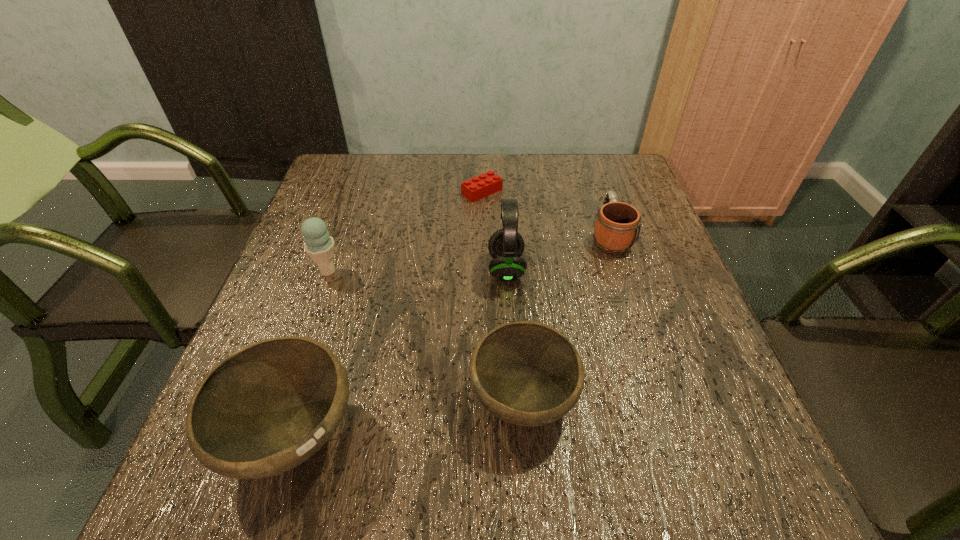
The height and width of the screenshot is (540, 960). In order to click on bowl situated at the left edge in this screenshot , I will do `click(263, 410)`.

Locate an element on the screen. This screenshot has height=540, width=960. ice cream present at the left edge is located at coordinates (319, 245).

Locate an element on the screen. The image size is (960, 540). object present at the right edge is located at coordinates (617, 226).

Identify the location of object that is at the near left corner. The width and height of the screenshot is (960, 540). (263, 410).

Find the location of `vacant area at the far edge of the desktop`. vacant area at the far edge of the desktop is located at coordinates pos(381,190).

Find the location of a particular element. The width and height of the screenshot is (960, 540). vacant space at the near edge of the desktop is located at coordinates (367, 401).

Find the location of a particular element. This screenshot has height=540, width=960. vacant space at the left edge is located at coordinates (302, 253).

Where is `vacant space at the far left corner of the desktop`? vacant space at the far left corner of the desktop is located at coordinates (341, 200).

In the image, there is a desktop. Where is `vacant space at the far right corner`? Image resolution: width=960 pixels, height=540 pixels. vacant space at the far right corner is located at coordinates (576, 154).

In the image, there is a desktop. Identify the location of vacant space at the near right corner. (696, 401).